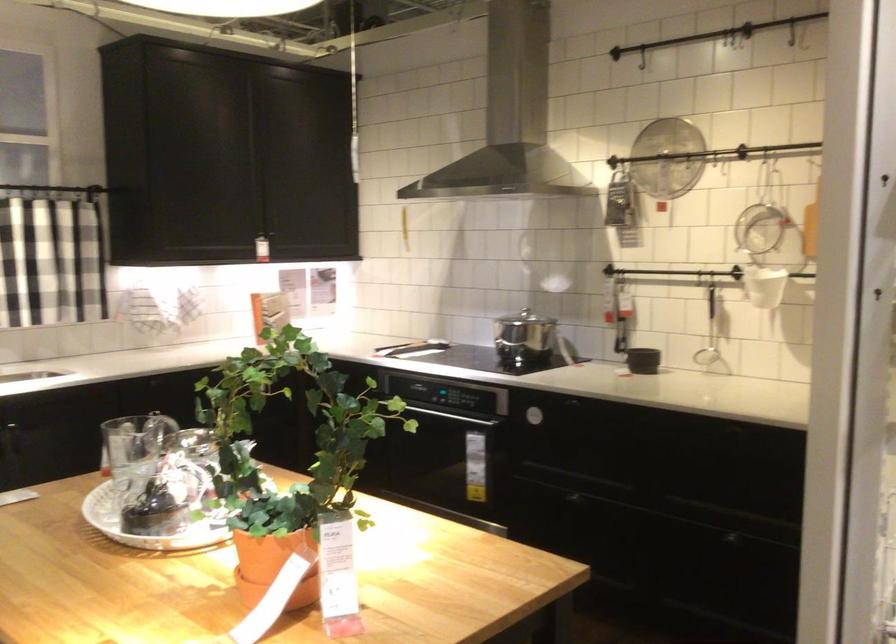
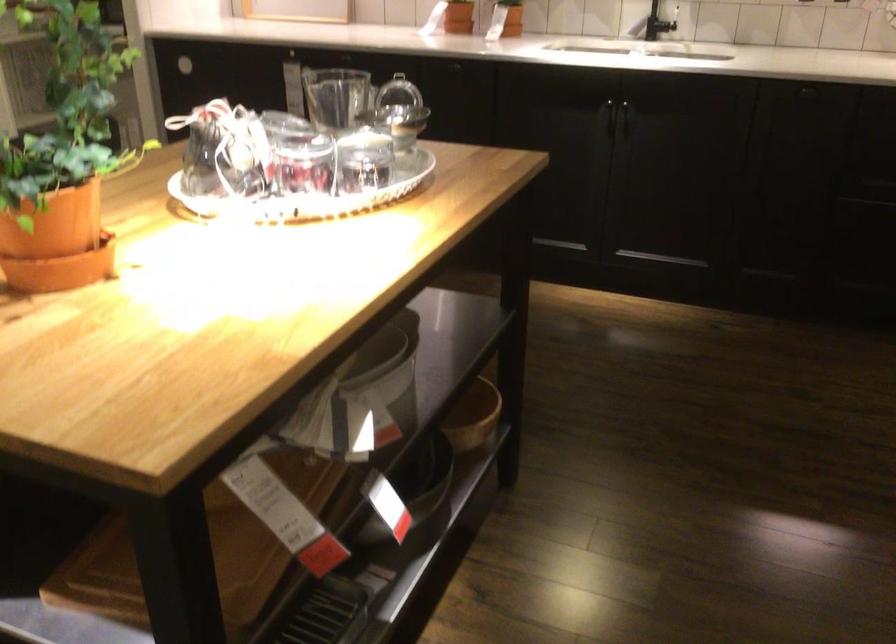
The point at (519, 574) is marked in the first image. Where is the corresponding point in the second image?

(135, 406)